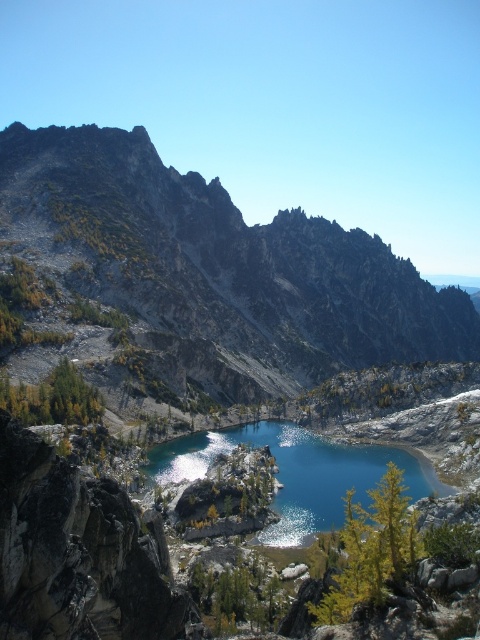
Is the position of rugged gray rock formation at center more distant than that of teal glossy water at center?

Yes, it is behind teal glossy water at center.

What do you see at coordinates (222, 266) in the screenshot?
I see `rugged gray rock formation at center` at bounding box center [222, 266].

Is point (193, 342) farther from viewer compared to point (279, 545)?

Yes, it is.

Locate an element on the screen. The height and width of the screenshot is (640, 480). rugged gray rock formation at center is located at coordinates tap(222, 266).